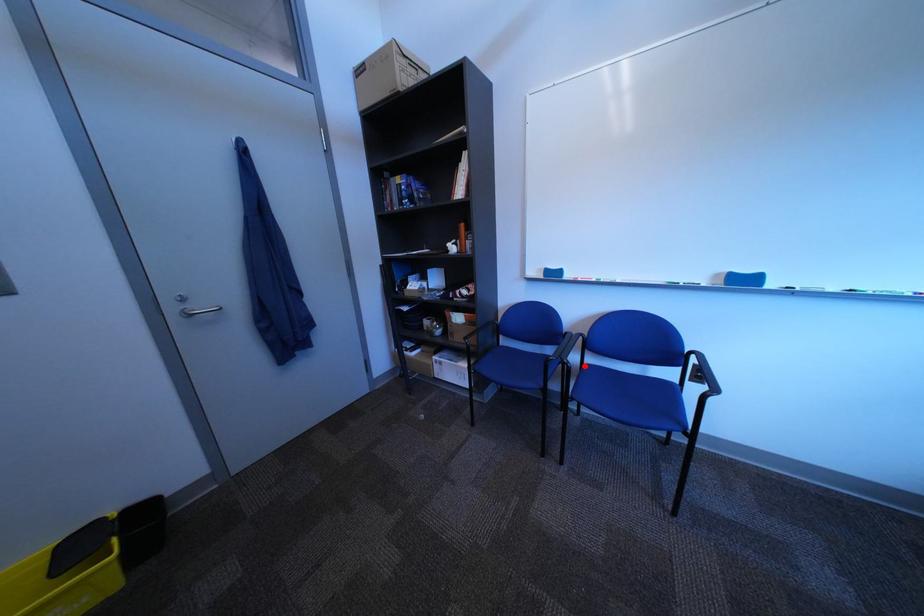
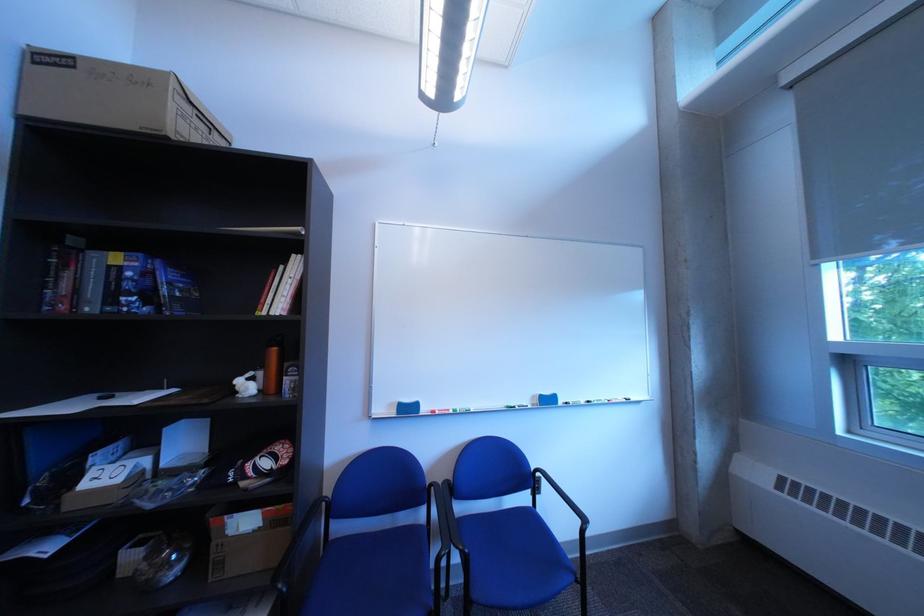
Question: A red point is marked in image1. In image2, is the corresponding 3D point closer to the camera or farther? Reply with the corresponding letter.

Choices:
 (A) The corresponding 3D point is closer.
 (B) The corresponding 3D point is farther.

Answer: (A)